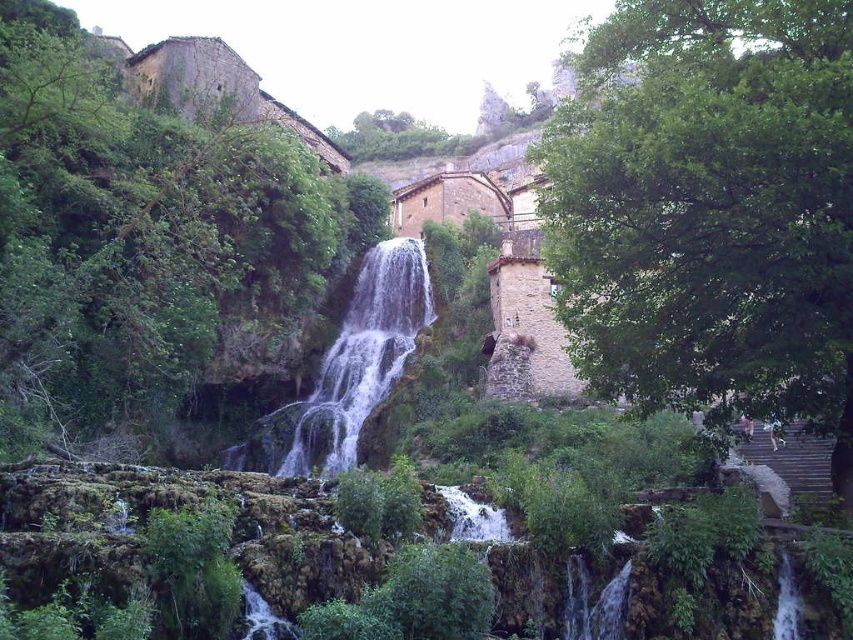
Can you confirm if green leafy tree at upper left is wider than green leafy tree at center?

Indeed, green leafy tree at upper left has a greater width compared to green leafy tree at center.

Can you confirm if green leafy tree at upper left is positioned below green leafy tree at center?

No.

Identify the location of green leafy tree at upper left. This screenshot has width=853, height=640. (158, 240).

Is green leafy tree at upper left to the left of green leafy tree at upper center from the viewer's perspective?

Correct, you'll find green leafy tree at upper left to the left of green leafy tree at upper center.

Which is more to the left, green leafy tree at upper left or green leafy tree at upper center?

green leafy tree at upper left is more to the left.

Locate an element on the screen. This screenshot has width=853, height=640. green leafy tree at upper left is located at coordinates (158, 240).

Is green leafy tree at center positioned behind green leafy tree at upper center?

No, green leafy tree at center is in front of green leafy tree at upper center.

Is point (810, 67) positioned before point (352, 145)?

That is True.

This screenshot has width=853, height=640. Identify the location of green leafy tree at center. (711, 209).